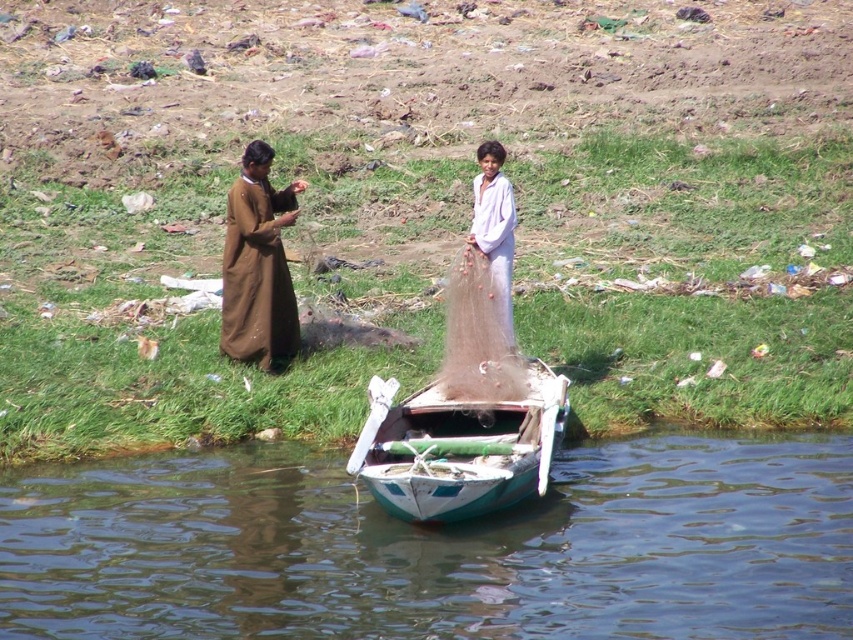
You are planning to place a new floating dock that is 3 meters wide in the scene. Given the smooth green water at lower center and the teal wooden boat at center, which object can accommodate the dock based on their widths?

The smooth green water at lower center has a larger width than the teal wooden boat at center, so the dock can be placed on the smooth green water at lower center.

You are a photographer trying to capture a clear shot of the teal wooden boat at center and the white matte net at center. Since you want both objects in focus, which one should you adjust your camera focus on first?

The teal wooden boat at center is closer to the viewer than the white matte net at center, so you should focus on the teal wooden boat at center first to ensure both are in focus.